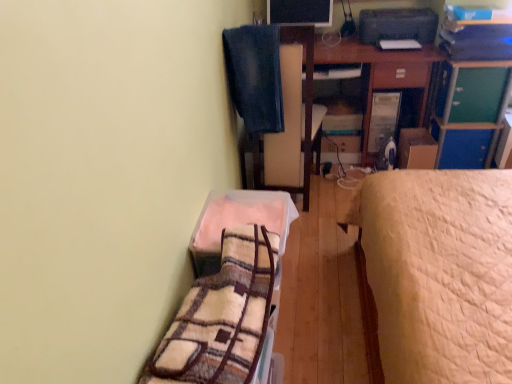
Question: Is wooden desk at upper right inside the boundaries of matte black monitor at upper center, or outside?

Choices:
 (A) outside
 (B) inside

Answer: (A)

Question: Is wooden desk at upper right wider or thinner than matte black monitor at upper center?

Choices:
 (A) thin
 (B) wide

Answer: (B)

Question: Which object is positioned closest to the plush beige blanket at lower center, positioned as the 2th blanket in back-to-front order?

Choices:
 (A) denim fabric swivel chair at upper center
 (B) denim at upper center, placed as the first blanket when sorted from top to bottom
 (C) green matte file cabinet at upper right
 (D) fuzzy fabric blanket at lower left
 (E) matte black monitor at upper center

Answer: (D)

Question: Estimate the real-world distances between objects in this image. Which object is farther from the matte black monitor at upper center?

Choices:
 (A) denim fabric swivel chair at upper center
 (B) plush beige blanket at lower center, acting as the first blanket starting from the front
 (C) green matte file cabinet at upper right
 (D) denim at upper center, placed as the first blanket when sorted from top to bottom
 (E) fuzzy fabric blanket at lower left

Answer: (E)